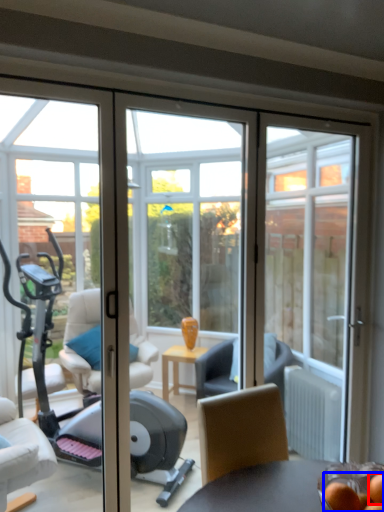
Question: Among these objects, which one is nearest to the camera, food (highlighted by a red box) or food (highlighted by a blue box)?

Choices:
 (A) food
 (B) food

Answer: (B)